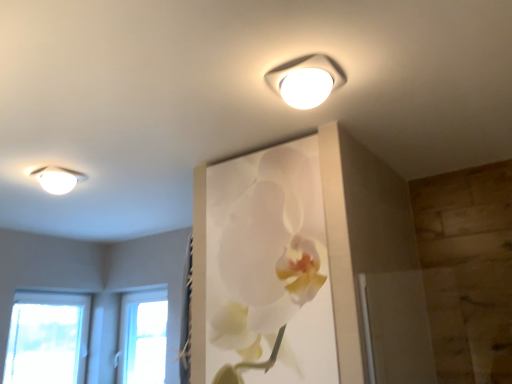
Question: Do you think white plastic lamp at upper center, positioned as the second lamp in back-to-front order, is within white matte orchid at upper center, or outside of it?

Choices:
 (A) inside
 (B) outside

Answer: (B)

Question: Looking at the image, does white plastic lamp at upper center, placed as the first lamp when sorted from right to left, seem bigger or smaller compared to white matte orchid at upper center?

Choices:
 (A) big
 (B) small

Answer: (B)

Question: Based on their relative distances, which object is farther from the transparent glass window at lower left?

Choices:
 (A) white glossy ceiling light at upper left, marked as the 2th lamp in a top-to-bottom arrangement
 (B) white matte orchid at upper center
 (C) white plastic lamp at upper center, the 2th lamp when ordered from left to right

Answer: (C)

Question: Which of these objects is positioned farthest from the white matte orchid at upper center?

Choices:
 (A) transparent glass window at lower left
 (B) white glossy ceiling light at upper left, the 1th lamp when ordered from back to front
 (C) white plastic lamp at upper center, arranged as the first lamp when viewed from the front

Answer: (A)